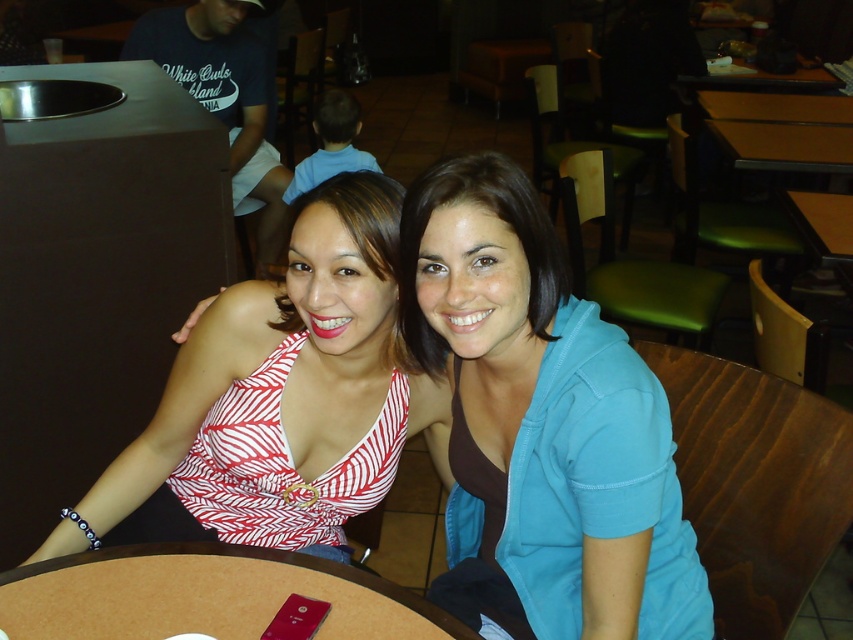
Question: Which object appears closest to the camera in this image?

Choices:
 (A) white and red striped tank top at center
 (B) brown wood round table at center

Answer: (B)

Question: Observing the image, what is the correct spatial positioning of brown wood round table at center in reference to green plastic table at upper right?

Choices:
 (A) above
 (B) below

Answer: (B)

Question: Which point is closer to the camera?

Choices:
 (A) white and red striped tank top at center
 (B) brown wood round table at center

Answer: (B)

Question: Estimate the real-world distances between objects in this image. Which object is farther from the brown wood round table at center?

Choices:
 (A) white and red striped tank top at center
 (B) yellow matte table at upper right
 (C) green plastic table at upper right
 (D) striped fabric top at center

Answer: (C)

Question: Does striped fabric top at center have a greater width compared to yellow matte table at upper right?

Choices:
 (A) yes
 (B) no

Answer: (B)

Question: Can you confirm if striped fabric top at center is wider than green plastic table at upper right?

Choices:
 (A) no
 (B) yes

Answer: (A)